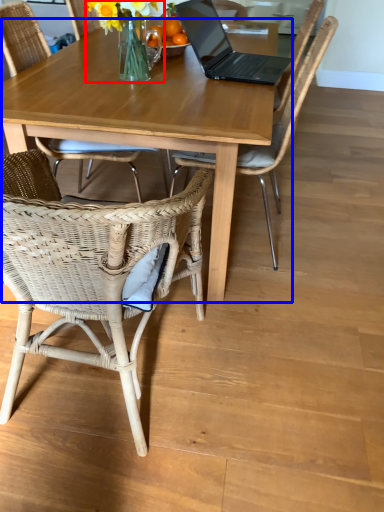
Question: Which object is further to the camera taking this photo, floral arrangement (highlighted by a red box) or coffee table (highlighted by a blue box)?

Choices:
 (A) floral arrangement
 (B) coffee table

Answer: (A)